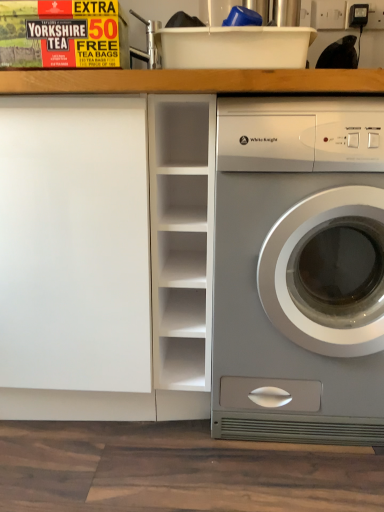
Question: Can you confirm if white matte bookshelf at center is smaller than satin silver washer at right?

Choices:
 (A) yes
 (B) no

Answer: (A)

Question: Considering the relative sizes of white matte bookshelf at center and satin silver washer at right in the image provided, is white matte bookshelf at center shorter than satin silver washer at right?

Choices:
 (A) yes
 (B) no

Answer: (A)

Question: Is white matte bookshelf at center not close to satin silver washer at right?

Choices:
 (A) yes
 (B) no

Answer: (B)

Question: Is white matte bookshelf at center touching satin silver washer at right?

Choices:
 (A) no
 (B) yes

Answer: (A)

Question: Does white matte bookshelf at center have a greater height compared to satin silver washer at right?

Choices:
 (A) no
 (B) yes

Answer: (A)

Question: Can you confirm if white matte bookshelf at center is positioned to the left of satin silver washer at right?

Choices:
 (A) yes
 (B) no

Answer: (A)

Question: From the image's perspective, is satin silver washer at right below white matte bookshelf at center?

Choices:
 (A) no
 (B) yes

Answer: (B)

Question: Does satin silver washer at right appear on the right side of white matte bookshelf at center?

Choices:
 (A) yes
 (B) no

Answer: (A)

Question: Does satin silver washer at right appear on the left side of white matte bookshelf at center?

Choices:
 (A) no
 (B) yes

Answer: (A)

Question: Can white matte bookshelf at center be found inside satin silver washer at right?

Choices:
 (A) no
 (B) yes

Answer: (A)

Question: From a real-world perspective, is satin silver washer at right physically below white matte bookshelf at center?

Choices:
 (A) no
 (B) yes

Answer: (B)

Question: Is the position of satin silver washer at right more distant than that of white matte bookshelf at center?

Choices:
 (A) no
 (B) yes

Answer: (A)

Question: In terms of height, does satin silver washer at right look taller or shorter compared to white matte bookshelf at center?

Choices:
 (A) tall
 (B) short

Answer: (A)